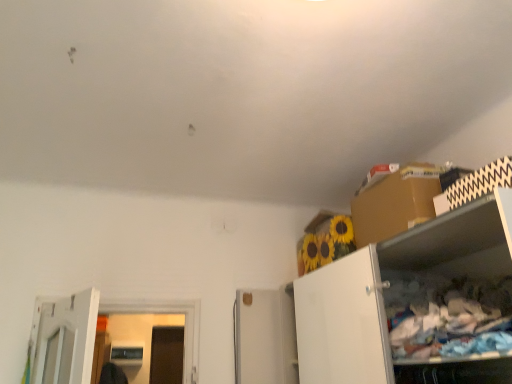
Question: From a real-world perspective, is white matte cabinet at right above or below brown cardboard box at upper right?

Choices:
 (A) below
 (B) above

Answer: (A)

Question: Is white matte cabinet at right in front of or behind brown cardboard box at upper right in the image?

Choices:
 (A) front
 (B) behind

Answer: (A)

Question: Is white matte cabinet at right spatially inside brown cardboard box at upper right, or outside of it?

Choices:
 (A) outside
 (B) inside

Answer: (A)

Question: Relative to white matte cabinet at right, is brown cardboard box at upper right in front or behind?

Choices:
 (A) front
 (B) behind

Answer: (B)

Question: From the image's perspective, is brown cardboard box at upper right positioned above or below white matte cabinet at right?

Choices:
 (A) below
 (B) above

Answer: (B)

Question: Would you say brown cardboard box at upper right is inside or outside white matte cabinet at right?

Choices:
 (A) outside
 (B) inside

Answer: (A)

Question: Is brown cardboard box at upper right taller or shorter than white matte cabinet at right?

Choices:
 (A) short
 (B) tall

Answer: (A)